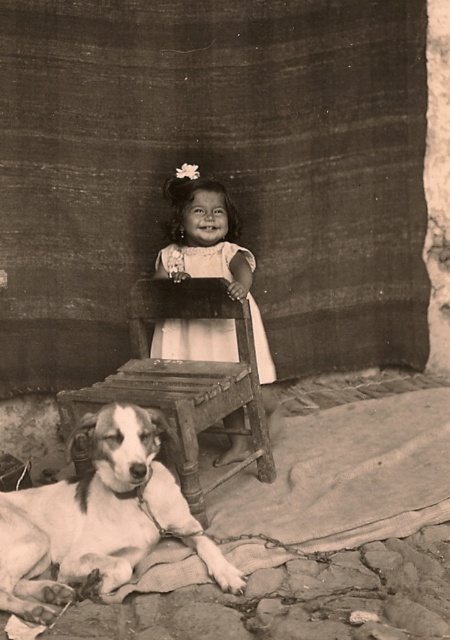
Does white matte dress at center have a lesser height compared to white cotton dress at center?

In fact, white matte dress at center may be taller than white cotton dress at center.

The width and height of the screenshot is (450, 640). Identify the location of white matte dress at center. (212, 253).

Which is behind, point (205, 353) or point (271, 378)?

The point (271, 378) is behind.

Locate an element on the screen. The image size is (450, 640). white matte dress at center is located at coordinates (212, 253).

Does white fur dog at lower left have a greater height compared to white matte dress at center?

No.

Between point (63, 596) and point (223, 323), which one is positioned behind?

Point (223, 323)

Who is more distant from viewer, (90, 545) or (153, 349)?

The point (153, 349) is more distant.

In order to click on white fur dog at lower left in this screenshot , I will do `click(99, 518)`.

Can you confirm if wooden stool at lower left is thinner than white cotton dress at center?

No.

How far apart are wooden stool at lower left and white cotton dress at center?

The distance of wooden stool at lower left from white cotton dress at center is 16.99 inches.

Image resolution: width=450 pixels, height=640 pixels. I want to click on wooden stool at lower left, so click(x=184, y=408).